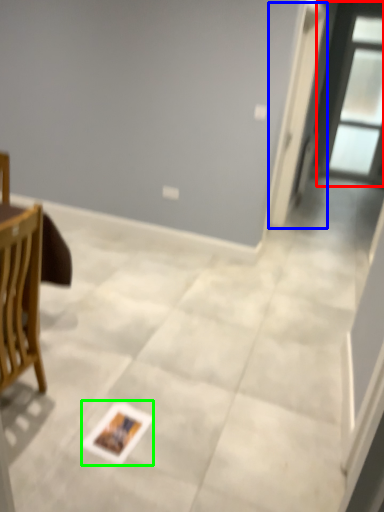
Question: Estimate the real-world distances between objects in this image. Which object is farther from window (highlighted by a red box), screen door (highlighted by a blue box) or postcard (highlighted by a green box)?

Choices:
 (A) screen door
 (B) postcard

Answer: (B)